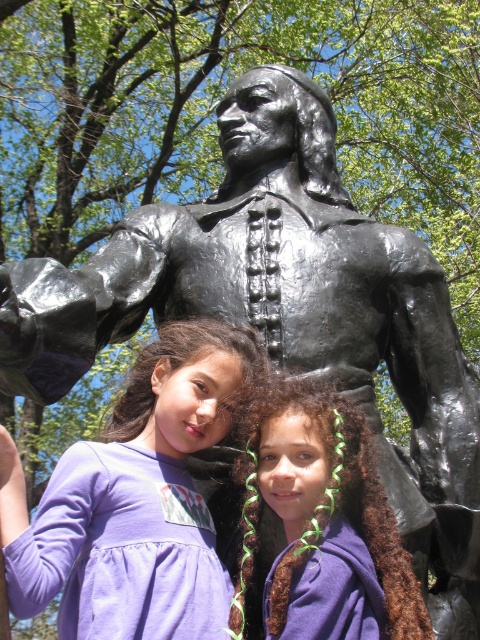
Looking at this image, you are a photographer who wants to capture a photo of the purple fabric shirt at lower center and the brown curly hair at center. Which object should you focus on first if you want to ensure both are in focus?

The purple fabric shirt at lower center is taller than the brown curly hair at center, so focusing on the purple fabric shirt at lower center first would help ensure both are in focus as it is the larger object.

You are taking a photo of the two girls standing in front of the statue. The camera requires the subject to be within a rectangular frame that spans from coordinates 0.6 to 0.9 on the horizontal axis and 0.2 to 0.4 on the vertical axis. Is the purple fabric shirt at lower center positioned within this frame?

The purple fabric shirt at lower center is located at point (134, 497). The frame spans from 0.6 to 0.9 horizontally and 0.2 to 0.4 vertically. Since both coordinates fall within the specified ranges, the purple fabric shirt at lower center is positioned within the frame.

You are a photographer taking a picture of the two girls in front of the statue. You need to ensure that the purple fabric shirt at lower center and the brown curly hair at center are both clearly visible in the frame. Based on their positions, which object is on the left side of the other?

The purple fabric shirt at lower center is positioned on the left side of brown curly hair at center, so the purple fabric shirt at lower center is on the left side of the brown curly hair at center.